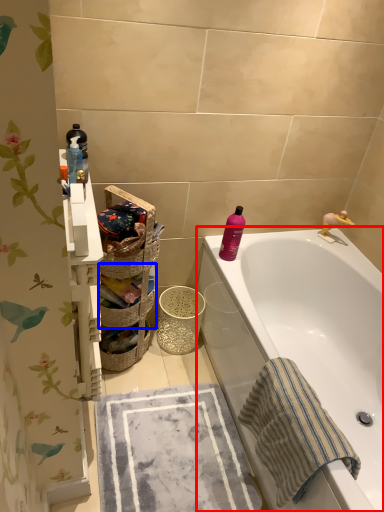
Question: Among these objects, which one is farthest to the camera, bathtub (highlighted by a red box) or basket (highlighted by a blue box)?

Choices:
 (A) bathtub
 (B) basket

Answer: (B)